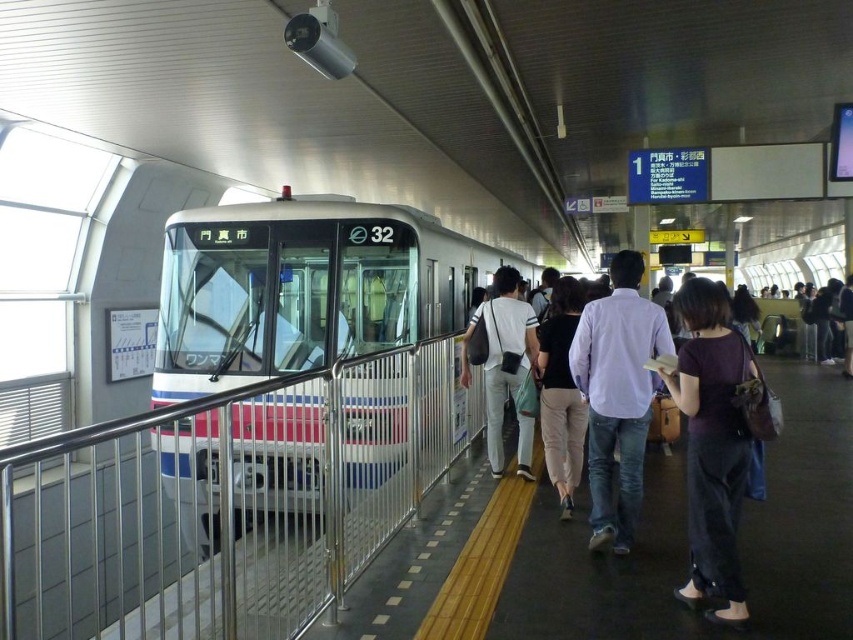
Is white glossy train at center positioned behind purple cotton shirt at center?

That is True.

This screenshot has height=640, width=853. Describe the element at coordinates (303, 288) in the screenshot. I see `white glossy train at center` at that location.

Which is behind, point (193, 310) or point (630, 488)?

Positioned behind is point (193, 310).

Where is `white glossy train at center`? The height and width of the screenshot is (640, 853). white glossy train at center is located at coordinates (303, 288).

Between white glossy train at center and dark purple fabric shirt at center-right, which one appears on the left side from the viewer's perspective?

white glossy train at center is more to the left.

Does white glossy train at center appear over dark purple fabric shirt at center-right?

Indeed, white glossy train at center is positioned over dark purple fabric shirt at center-right.

Is point (247, 220) positioned before point (683, 324)?

That is False.

Locate an element on the screen. Image resolution: width=853 pixels, height=640 pixels. white glossy train at center is located at coordinates (303, 288).

Can you confirm if silver metallic rail at left is smaller than dark purple fabric shirt at center-right?

Yes, silver metallic rail at left is smaller than dark purple fabric shirt at center-right.

What do you see at coordinates (225, 502) in the screenshot?
I see `silver metallic rail at left` at bounding box center [225, 502].

Who is more forward, (x=302, y=602) or (x=706, y=442)?

Point (x=302, y=602) is in front.

Find the location of a particular element. The width and height of the screenshot is (853, 640). silver metallic rail at left is located at coordinates (225, 502).